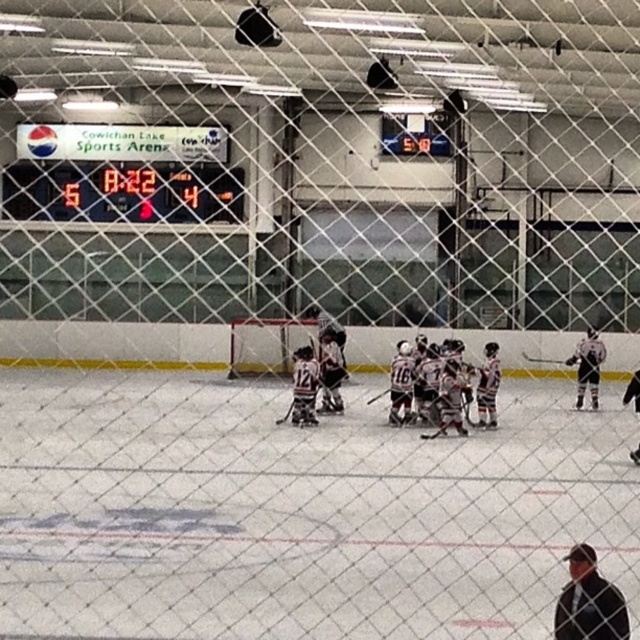
Which is above, white ice at center or digital display scoreboard at upper left?

digital display scoreboard at upper left is higher up.

Is white ice at center positioned before digital display scoreboard at upper left?

Yes, white ice at center is in front of digital display scoreboard at upper left.

You are a GUI agent. You are given a task and a screenshot of the screen. Output one action in this format:
    pyautogui.click(x=<x>, y=<y>)
    Task: Click on the white ice at center
    The height and width of the screenshot is (640, 640).
    Given the screenshot: What is the action you would take?
    pyautogui.click(x=298, y=513)

Identify the location of white ice at center. (298, 513).